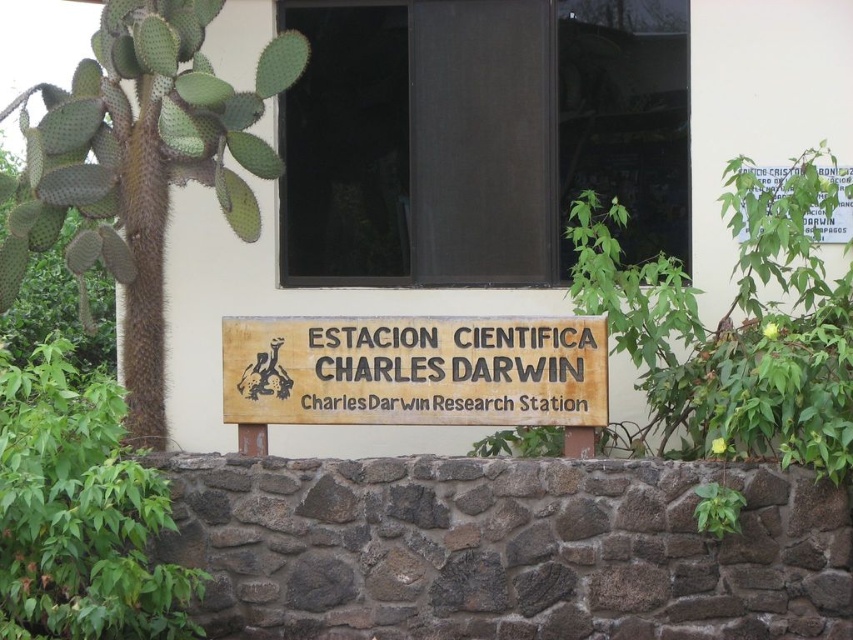
In the scene shown: You are a visitor at the Charles Darwin Research Station and want to take a photo of both the wooden sign at center and the white paper sign at upper right in the same frame. The camera you are using has a maximum focal length that allows capturing objects up to 2 meters apart. Will you be able to include both signs in a single photo without moving the camera?

The wooden sign at center and white paper sign at upper right are 1.90 meters apart from each other. Since the camera can capture objects up to 2 meters apart, you can include both signs in a single photo without moving the camera.

In the scene shown: You are standing at the camera position and want to take a photo of the green spiny cactus at left. Is the camera close enough to capture the cactus clearly without moving?

The green spiny cactus at left and camera are 6.28 meters apart from each other. Since most cameras can focus clearly at distances of 6 meters or more, the camera is close enough to capture the cactus clearly without moving.

You are standing at the point closer to the signboard. Which point are you at, point [491,410] or point [815,200]?

Point [491,410] is in front of point [815,200], so you are at point [491,410].